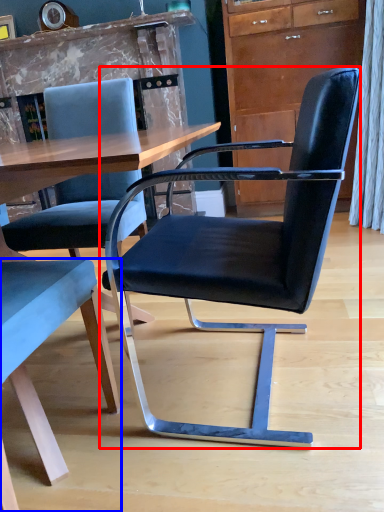
Question: Which object is closer to the camera taking this photo, chair (highlighted by a red box) or chair (highlighted by a blue box)?

Choices:
 (A) chair
 (B) chair

Answer: (B)